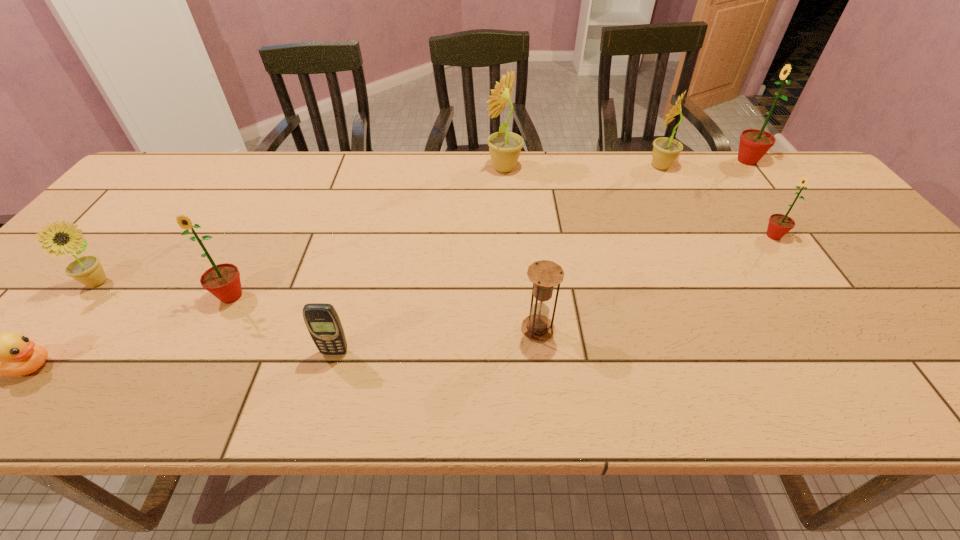
Identify the location of the biggest yellow sunflower. (505, 147).

Where is `the fourth sunflower from right to left`? The image size is (960, 540). the fourth sunflower from right to left is located at coordinates (505, 147).

What are the coordinates of `the biggest green sunflower` in the screenshot? It's located at (754, 144).

Where is `the rightmost sunflower`? the rightmost sunflower is located at coordinates (754, 144).

At what (x,y) coordinates should I click in order to perform the action: click on the seventh object from left to right. Please return your answer as a coordinate pair (x, y). This screenshot has width=960, height=540. Looking at the image, I should click on (666, 150).

This screenshot has height=540, width=960. Identify the location of the fourth sunflower from left to right. (666, 150).

Locate an element on the screen. The height and width of the screenshot is (540, 960). the second sunflower from left to right is located at coordinates [223, 281].

Find the location of a particular element. The width and height of the screenshot is (960, 540). the seventh object from right to left is located at coordinates (223, 281).

Locate an element on the screen. The height and width of the screenshot is (540, 960). the nearest yellow sunflower is located at coordinates (87, 270).

Where is `the leftmost yellow sunflower`? the leftmost yellow sunflower is located at coordinates (87, 270).